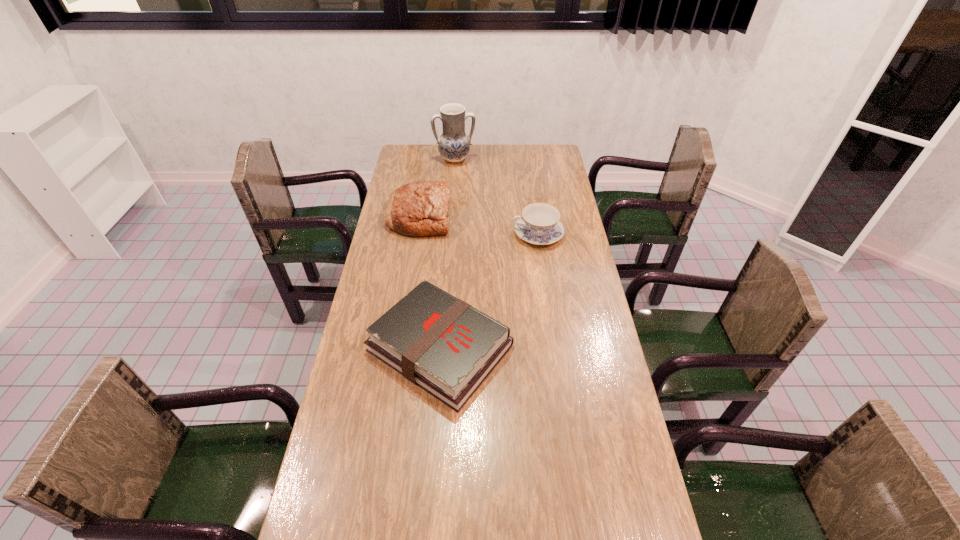
Where is `free space located with the handle on the side of the rightmost object`? This screenshot has height=540, width=960. free space located with the handle on the side of the rightmost object is located at coordinates (465, 234).

At what (x,y) coordinates should I click in order to perform the action: click on object present at the far edge. Please return your answer as a coordinate pair (x, y). The image size is (960, 540). Looking at the image, I should click on (454, 145).

Locate an element on the screen. Image resolution: width=960 pixels, height=540 pixels. bread situated at the left edge is located at coordinates (421, 208).

Identify the location of hardback book situated at the left edge. The height and width of the screenshot is (540, 960). (440, 343).

In order to click on object that is at the right edge in this screenshot , I will do `click(539, 224)`.

The height and width of the screenshot is (540, 960). In order to click on free location at the far edge in this screenshot , I will do `click(478, 149)`.

Identify the location of vacant space at the left edge of the desktop. The width and height of the screenshot is (960, 540). (377, 246).

Locate an element on the screen. free space at the right edge of the desktop is located at coordinates (564, 375).

Where is `free space at the far left corner of the desktop`? Image resolution: width=960 pixels, height=540 pixels. free space at the far left corner of the desktop is located at coordinates (403, 166).

Identify the location of free spot between the pottery and the hardback book. (447, 254).